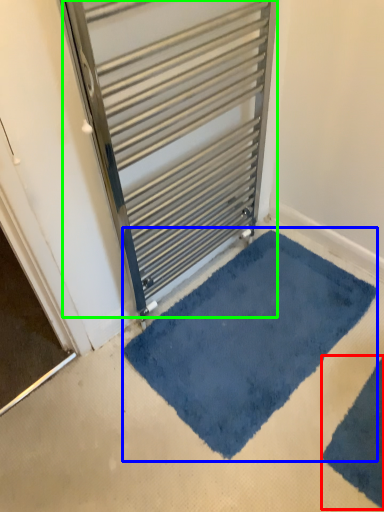
Question: Considering the real-world distances, which object is closest to bath mat (highlighted by a red box)? bath mat (highlighted by a blue box) or door (highlighted by a green box).

Choices:
 (A) bath mat
 (B) door

Answer: (A)